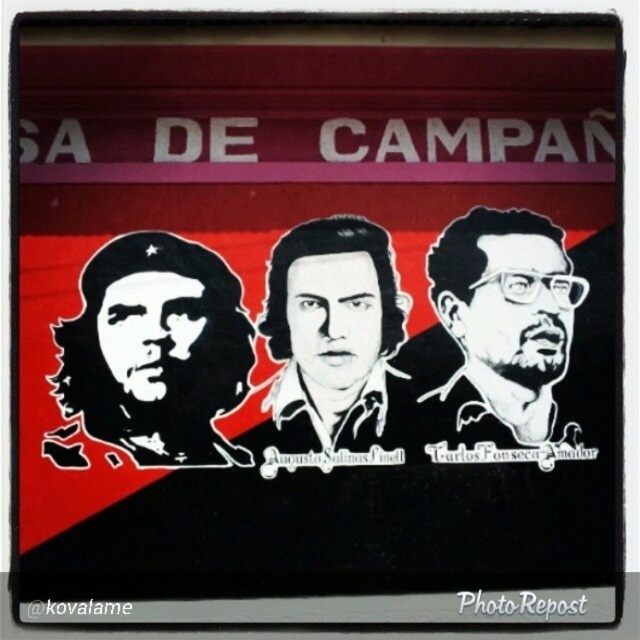
You are designing a layout for a poster and need to place a new element exactly where the black ink portrait at right is currently positioned. According to the coordinates provided, what are the coordinates of the location where you should place your new element?

The coordinates for the location where the black ink portrait at right is positioned are 0.514 on the x axis and 0.775 on the y axis.

You are designing a gallery layout where space is limited. You have two portraits to display side by side. The black matte portrait at left and the black ink portrait at right. Given their sizes, which portrait should you place closer to the entrance to ensure both fit within the 1.5 meter display area?

The black matte portrait at left is wider than the black ink portrait at right. To fit both within the 1.5 meter display area, place the wider black matte portrait at left first near the entrance, followed by the narrower black ink portrait at right. This arrangement ensures they fit without exceeding the space.

You are an observer looking at the poster. There are two points marked on the poster at coordinates point (163, 435) and point (333, 442). Which point is closer to you?

Point (163, 435) is closer to the viewer than point (333, 442).